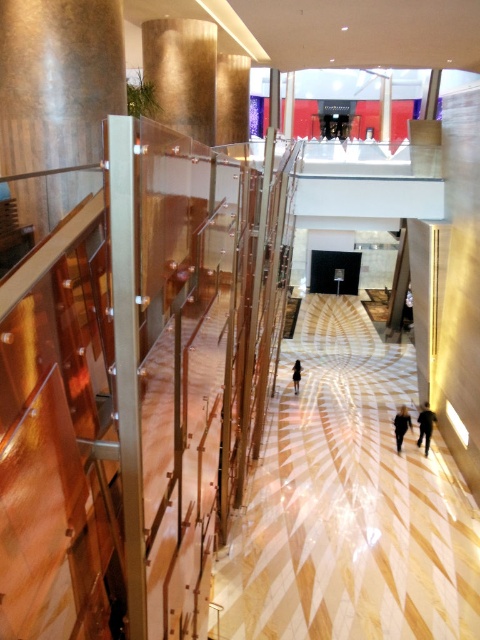
You are an event planner setting up chairs for a presentation. You need to place chairs along the width of the dark gray fabric person at lower right and the blurred black clothing at center. Which person requires more chairs to cover their width?

The dark gray fabric person at lower right requires more chairs to cover their width since it is wider than the blurred black clothing at center.

You are standing at the entrance of the building and see the point marked at coordinates (400, 426). What is located at that point?

The point marked at coordinates (400, 426) indicates the location of blurred black clothing at center.

You are a delivery person carrying a large package and need to walk through the space between the white glossy floor at center and the blurred black clothing at center. Can you pass through without bending down?

The white glossy floor at center is wider than the blurred black clothing at center, so the space between them is sufficient for you to pass through without bending down.